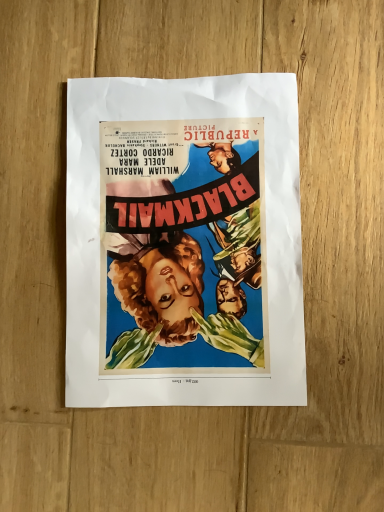
The image size is (384, 512). What do you see at coordinates (266, 231) in the screenshot? I see `vibrant paper poster at center` at bounding box center [266, 231].

Find the location of a particular element. The height and width of the screenshot is (512, 384). vibrant paper poster at center is located at coordinates (266, 231).

Where is `vibrant paper poster at center`? The height and width of the screenshot is (512, 384). vibrant paper poster at center is located at coordinates (266, 231).